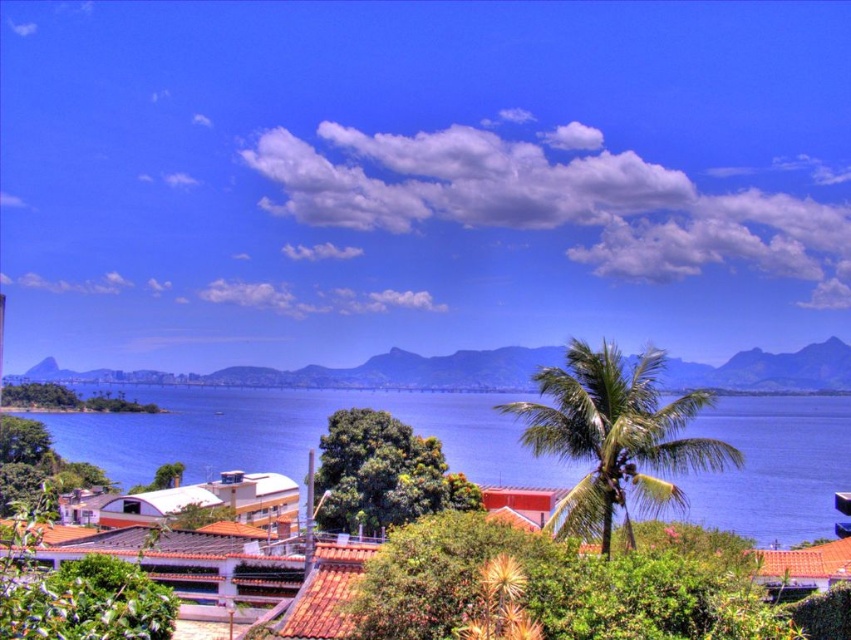
Between blue water at center and green leafy palm tree at center, which one is positioned higher?

green leafy palm tree at center is above.

Who is more forward, (484,483) or (589,452)?

Positioned in front is point (589,452).

The width and height of the screenshot is (851, 640). Identify the location of blue water at center. [x=294, y=433].

Where is `blue water at center`? The height and width of the screenshot is (640, 851). blue water at center is located at coordinates (294, 433).